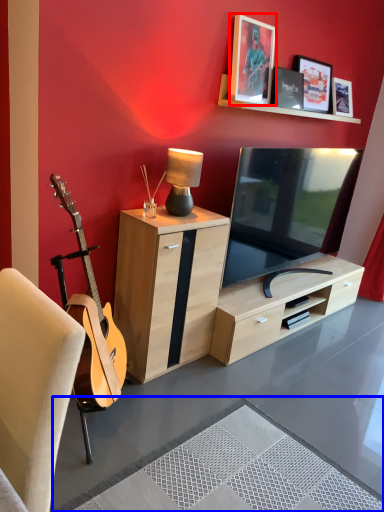
Question: Among these objects, which one is farthest to the camera, picture frame (highlighted by a red box) or plain (highlighted by a blue box)?

Choices:
 (A) picture frame
 (B) plain

Answer: (A)